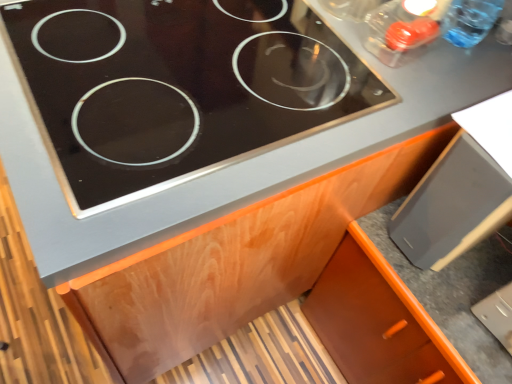
Question: Looking at the image, does transparent plastic bottle at upper right seem bigger or smaller compared to orange wood cabinet at lower right?

Choices:
 (A) small
 (B) big

Answer: (A)

Question: From their relative heights in the image, would you say transparent plastic bottle at upper right is taller or shorter than orange wood cabinet at lower right?

Choices:
 (A) short
 (B) tall

Answer: (A)

Question: Considering the real-world distances, which object is farthest from the orange wood cabinet at lower right?

Choices:
 (A) black glass cooktop at upper center
 (B) transparent plastic bottle at upper right
 (C) matte black drawer at lower right

Answer: (B)

Question: Which is nearer to the black glass cooktop at upper center?

Choices:
 (A) orange wood cabinet at lower right
 (B) transparent plastic bottle at upper right
 (C) matte black drawer at lower right

Answer: (C)